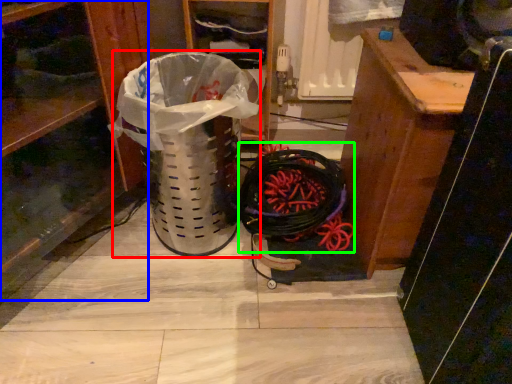
Question: Based on their relative distances, which object is farther from garbage (highlighted by a red box)? Choose from shelf (highlighted by a blue box) and battle rope (highlighted by a green box).

Choices:
 (A) shelf
 (B) battle rope

Answer: (B)